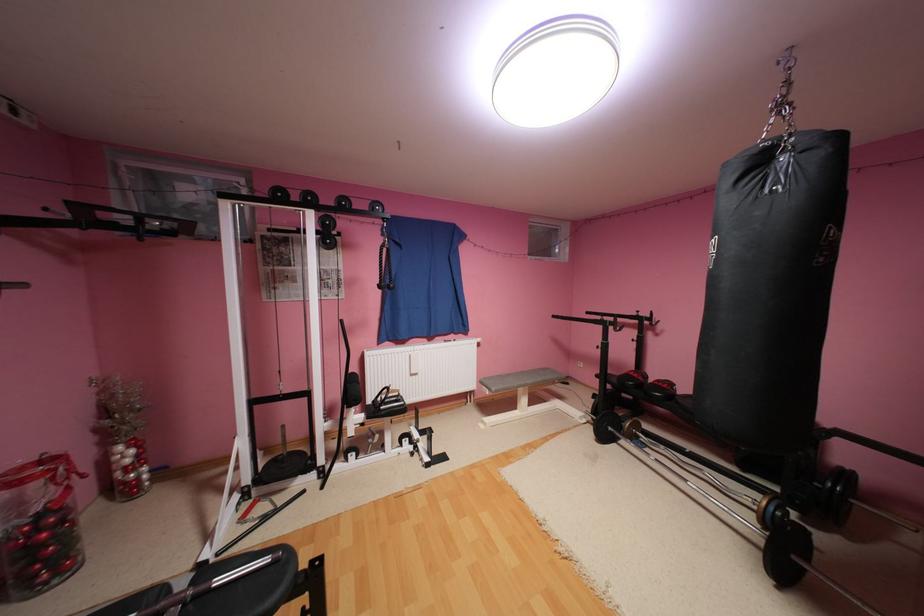
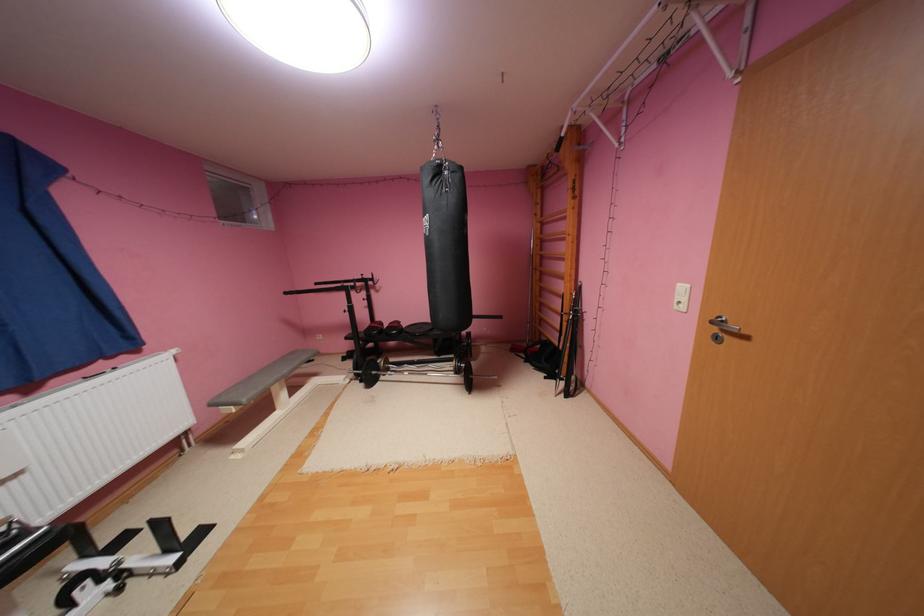
Where in the second image is the point corresponding to [563,315] from the first image?

(295, 293)